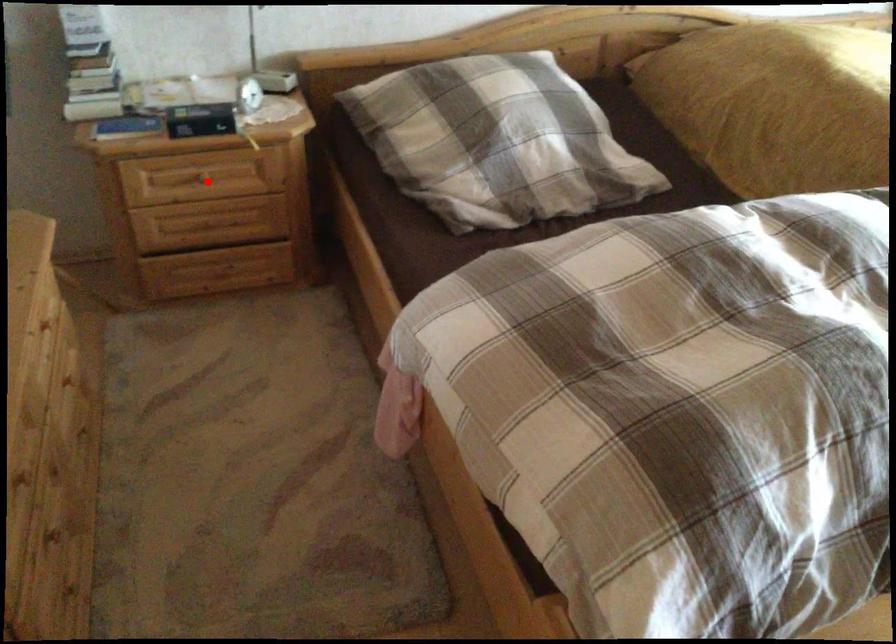
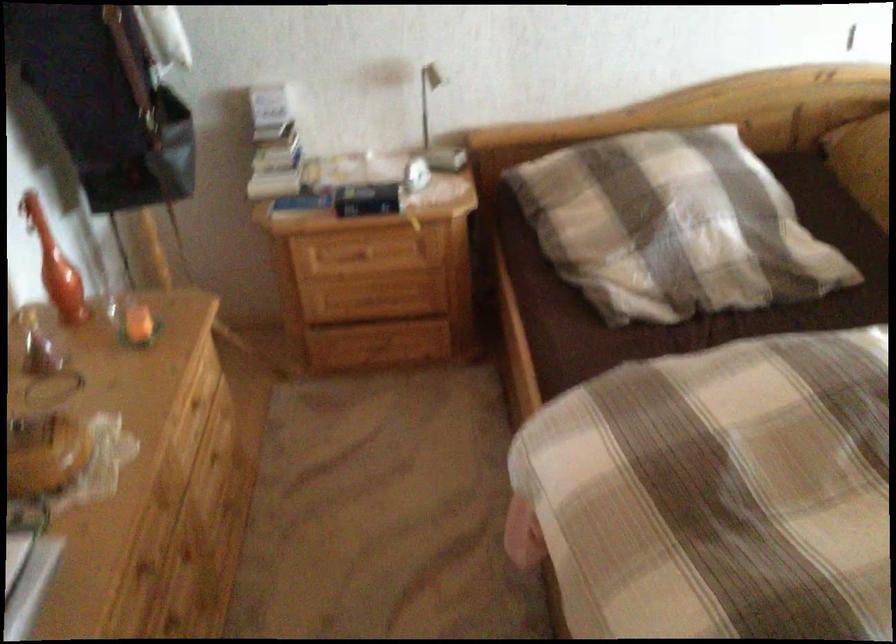
In the second image, find the point that corresponds to the highlighted location in the first image.

(366, 252)